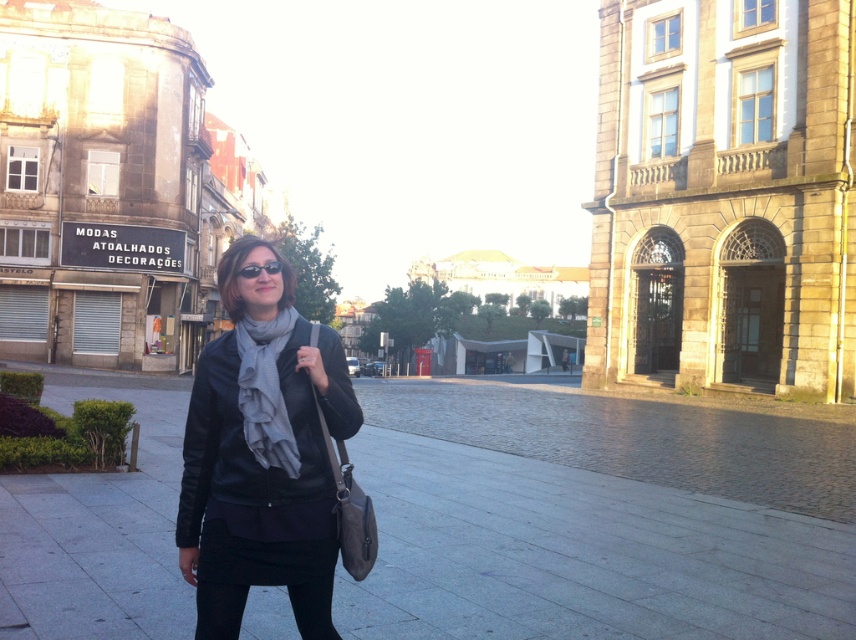
Question: Does smooth concrete pavement at center appear over matte black jacket at center?

Choices:
 (A) no
 (B) yes

Answer: (A)

Question: Does black leather skirt at lower center appear under black matte sunglasses at center?

Choices:
 (A) yes
 (B) no

Answer: (A)

Question: Which object appears farthest from the camera in this image?

Choices:
 (A) black matte sunglasses at center
 (B) black leather skirt at lower center
 (C) matte black jacket at center
 (D) smooth concrete pavement at center

Answer: (D)

Question: Does smooth concrete pavement at center appear on the right side of black matte sunglasses at center?

Choices:
 (A) no
 (B) yes

Answer: (A)

Question: Which point is closer to the camera?

Choices:
 (A) (266, 268)
 (B) (342, 406)
 (C) (58, 392)

Answer: (B)

Question: Which point is farther to the camera?

Choices:
 (A) (282, 435)
 (B) (314, 541)
 (C) (218, 376)
 (D) (468, 467)

Answer: (D)